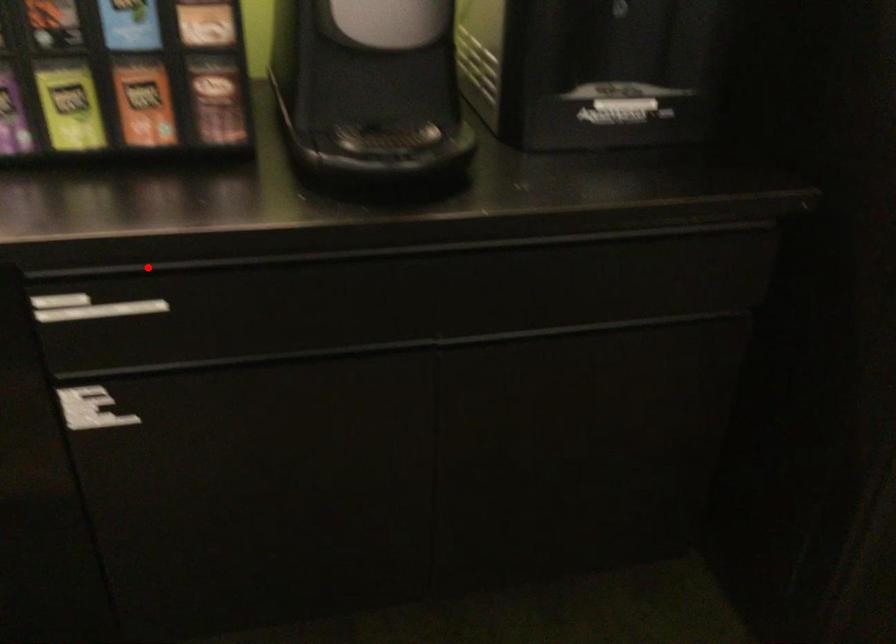
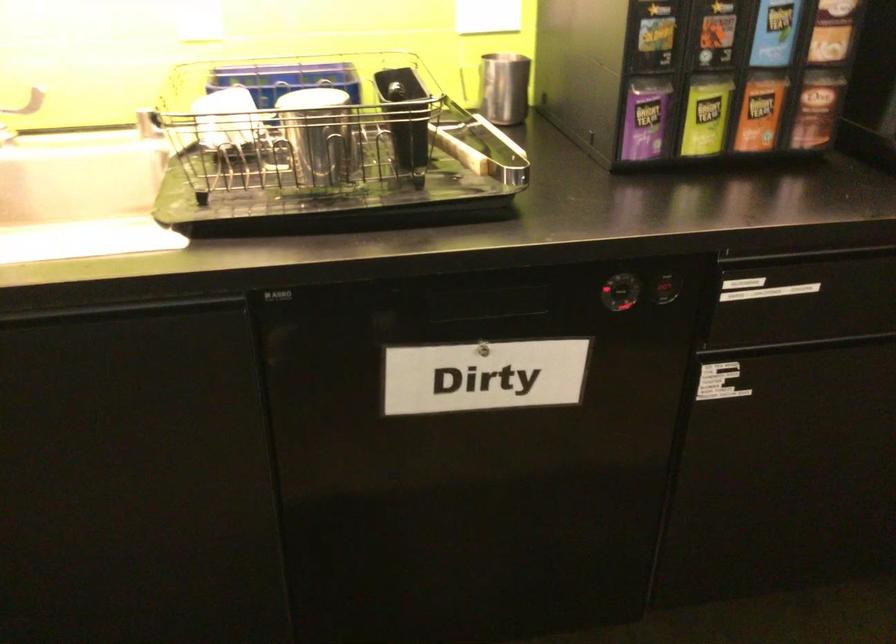
Find the pixel in the second image that matches the highlighted location in the first image.

(807, 254)